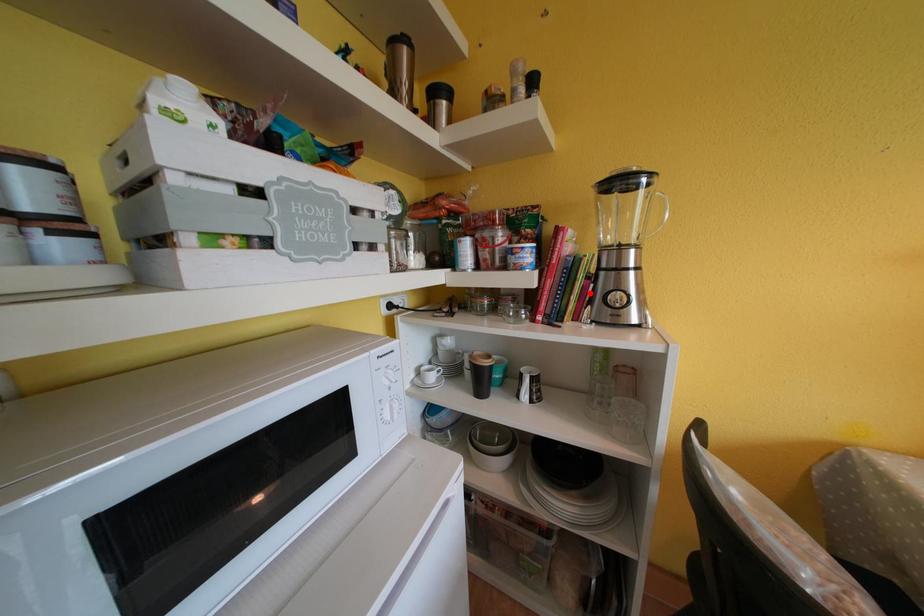
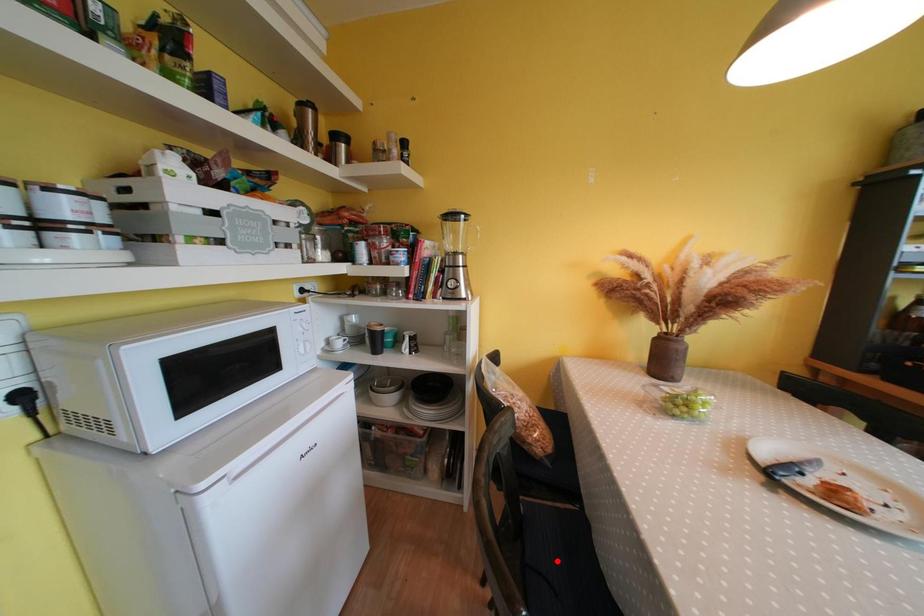
I am providing you with two images of the same scene from different viewpoints. A red point is marked on the first image and another point is marked on the second image. Are the points marked in image1 and image2 representing the same 3D position?

No